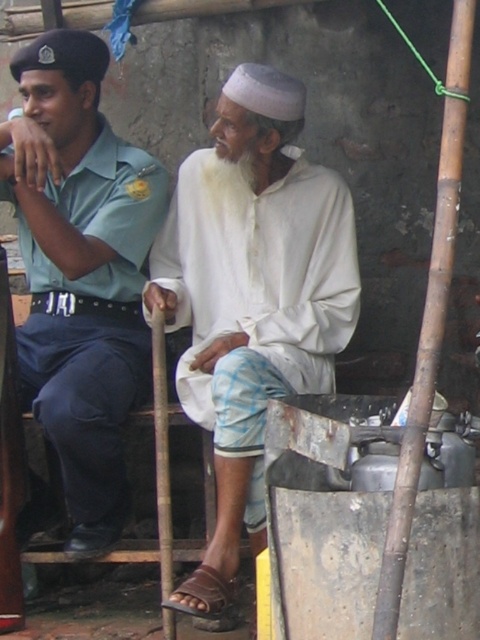
Locate an element on the screen. Image resolution: width=480 pixels, height=640 pixels. green uniform at left is located at coordinates (81, 272).

Is green uniform at left above brown leather sandal at lower center?

Yes.

Locate an element on the screen. green uniform at left is located at coordinates (81, 272).

The width and height of the screenshot is (480, 640). Identify the location of green uniform at left. (81, 272).

Between white matte cloth at center and green uniform at left, which one appears on the left side from the viewer's perspective?

Positioned to the left is green uniform at left.

Is white matte cloth at center shorter than green uniform at left?

Correct, white matte cloth at center is not as tall as green uniform at left.

The image size is (480, 640). What do you see at coordinates (253, 285) in the screenshot?
I see `white matte cloth at center` at bounding box center [253, 285].

Find the location of a particular element. This screenshot has height=640, width=480. white matte cloth at center is located at coordinates (253, 285).

Between white matte cloth at center and brown leather sandal at lower center, which one is positioned lower?

Positioned lower is brown leather sandal at lower center.

Locate an element on the screen. The image size is (480, 640). white matte cloth at center is located at coordinates (253, 285).

Does point (229, 320) lie in front of point (212, 592)?

That is False.

Find the location of a particular element. The width and height of the screenshot is (480, 640). white matte cloth at center is located at coordinates pyautogui.click(x=253, y=285).